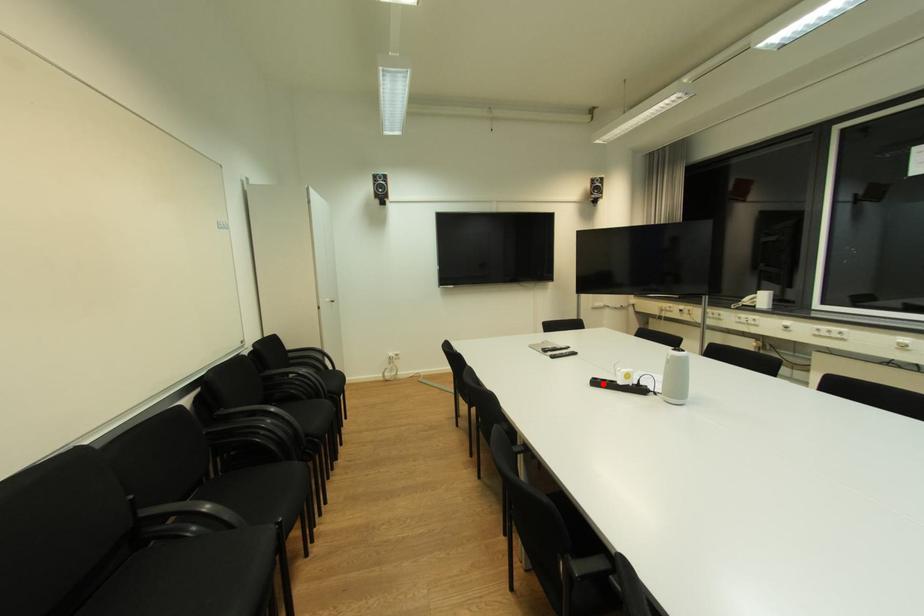
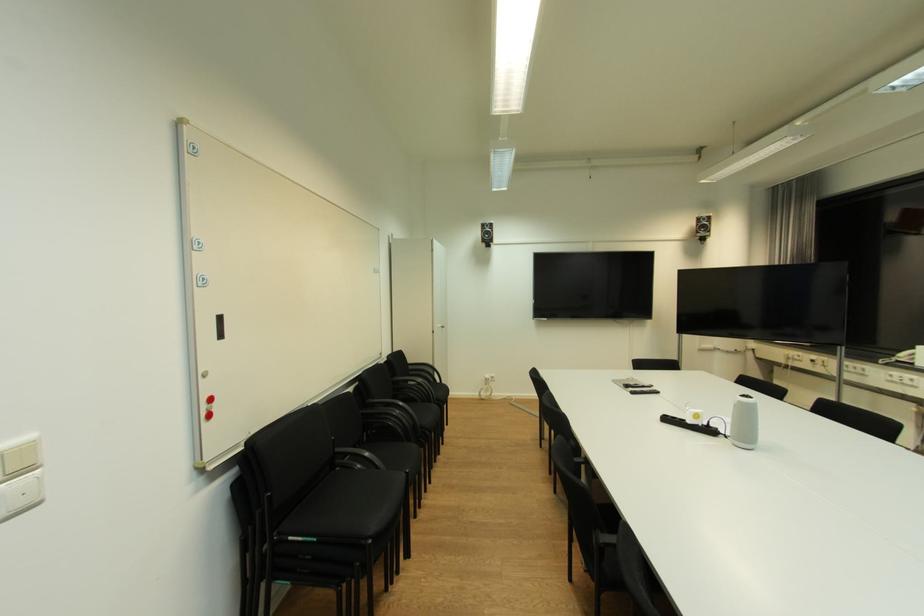
The point at the highlighted location is marked in the first image. Where is the corresponding point in the second image?

(674, 421)